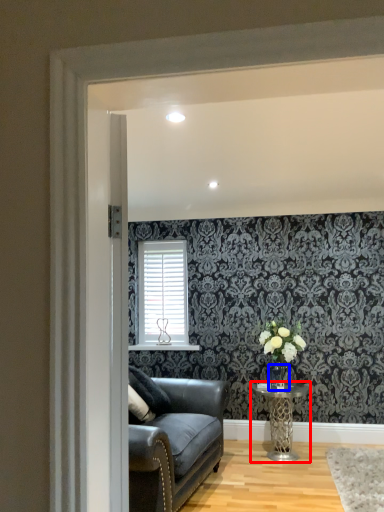
Question: Among these objects, which one is nearest to the camera, table (highlighted by a red box) or glass vase (highlighted by a blue box)?

Choices:
 (A) table
 (B) glass vase

Answer: (A)